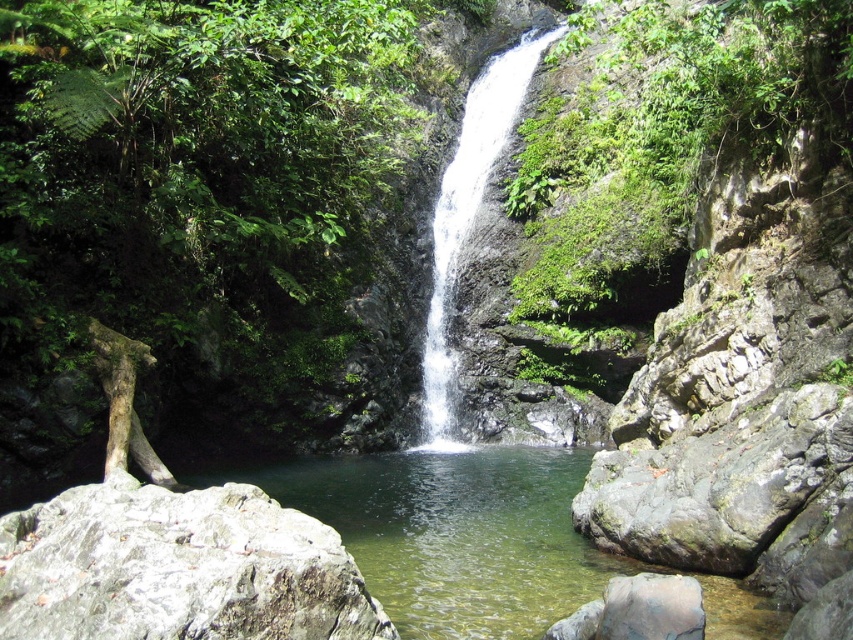
Question: Is clear water at center positioned in front of gray rough rock at right?

Choices:
 (A) yes
 (B) no

Answer: (A)

Question: Does gray rough rock at lower left come behind white smooth waterfall at center?

Choices:
 (A) yes
 (B) no

Answer: (B)

Question: Considering the relative positions of clear water at center and gray rough rock at lower left in the image provided, where is clear water at center located with respect to gray rough rock at lower left?

Choices:
 (A) right
 (B) left

Answer: (A)

Question: Based on their relative distances, which object is nearer to the gray rough rock at lower left?

Choices:
 (A) white smooth waterfall at center
 (B) clear water at center

Answer: (B)

Question: Which of the following is the closest to the observer?

Choices:
 (A) clear water at center
 (B) gray rough rock at lower left
 (C) gray rough rock at right
 (D) white smooth waterfall at center

Answer: (B)

Question: Among these points, which one is farthest from the camera?

Choices:
 (A) (432, 220)
 (B) (253, 570)
 (C) (677, 506)
 (D) (361, 545)

Answer: (A)